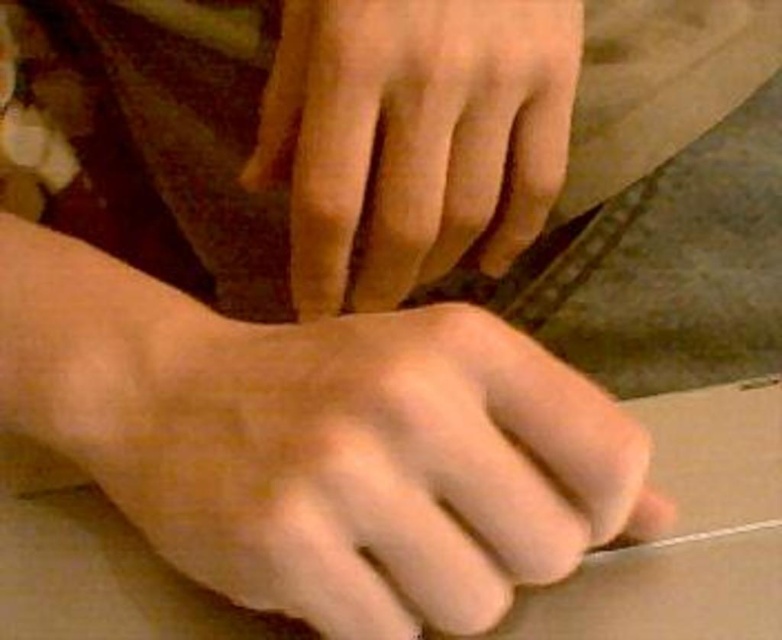
You are a beginner woodworker trying to position your hands correctly while holding a piece of wood. The smooth skin hand at lower center is your non dominant hand, and the smooth skin hand at center is your dominant hand. Which hand is positioned higher?

The smooth skin hand at center is positioned higher because it is taller than the smooth skin hand at lower center.

You are a photographer trying to capture a close detail shot of the hands and the object they are working on. The camera you are using has a depth of field that can clearly focus on objects within 12 inches of the lens. Based on the scene described, will the point at coordinates point (x=267, y=348) be within the camera focus range?

The distance between point (x=267, y=348) and the camera is 13.31 inches. Since the camera can only focus on objects within 12 inches, the point is outside the focus range and will not be in focus.

From the picture: You are an assistant observing two hands in a crafting activity. The smooth skin hand at lower center and the smooth skin hand at center are both involved. Which hand is larger?

The smooth skin hand at lower center is bigger than the smooth skin hand at center.